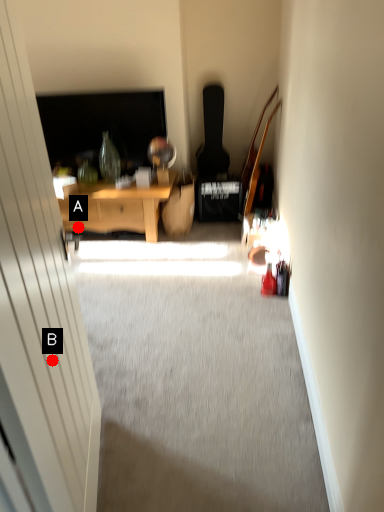
Question: Two points are circled on the image, labeled by A and B beside each circle. Which point is closer to the camera taking this photo?

Choices:
 (A) A is closer
 (B) B is closer

Answer: (B)